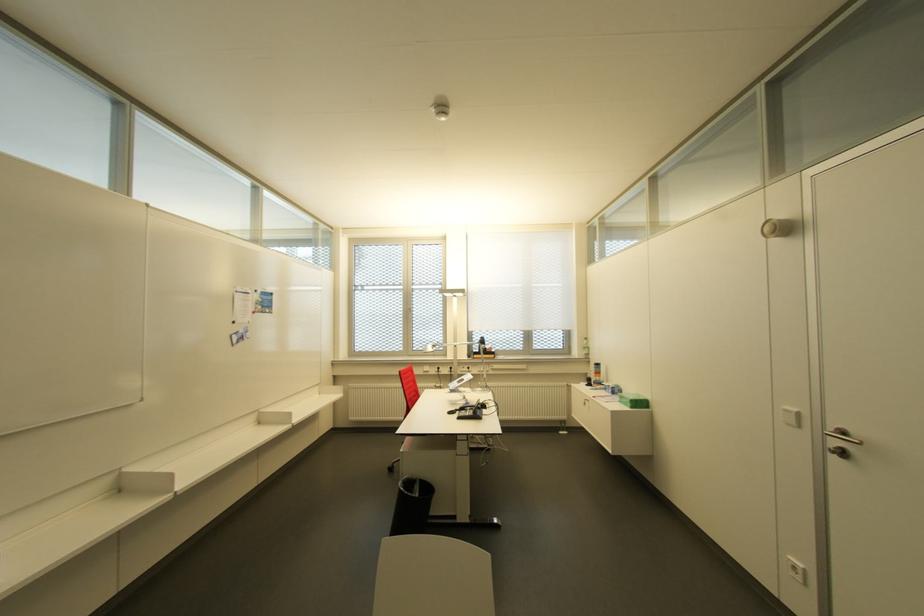
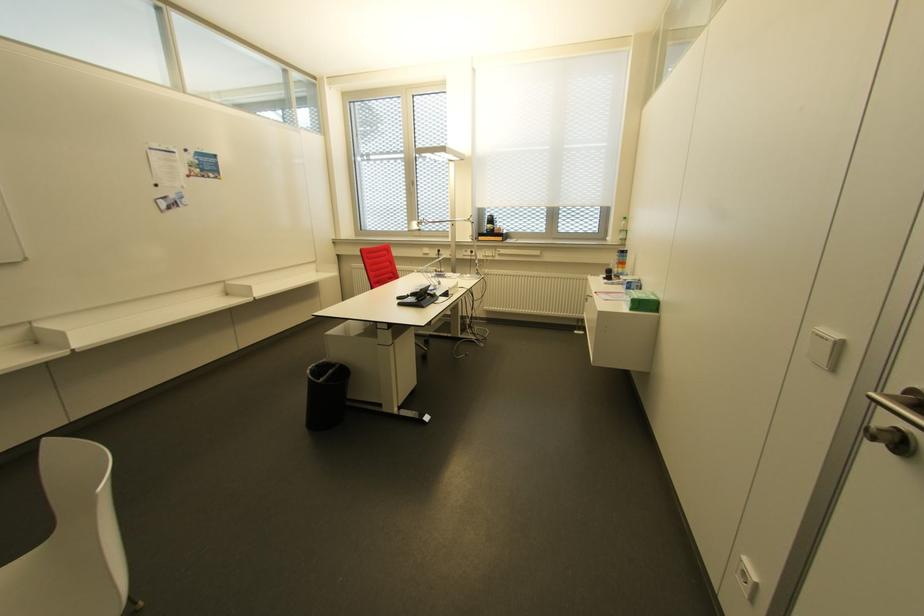
The point at (459, 408) is marked in the first image. Where is the corresponding point in the second image?

(410, 294)